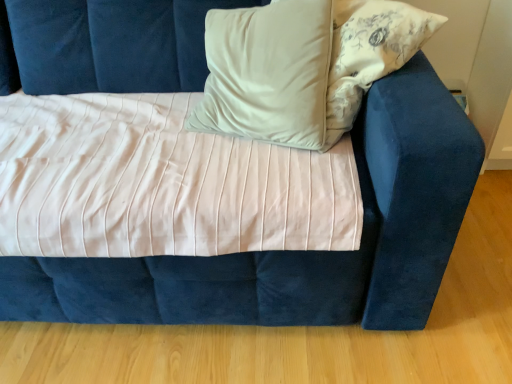
The width and height of the screenshot is (512, 384). What do you see at coordinates (302, 67) in the screenshot?
I see `beige satin pillow at upper center` at bounding box center [302, 67].

You are a GUI agent. You are given a task and a screenshot of the screen. Output one action in this format:
    pyautogui.click(x=<x>, y=<y>)
    Task: Click on the beige satin pillow at upper center
    Image resolution: width=512 pixels, height=384 pixels.
    Given the screenshot: What is the action you would take?
    pyautogui.click(x=302, y=67)

The width and height of the screenshot is (512, 384). In order to click on beige satin pillow at upper center in this screenshot , I will do `click(302, 67)`.